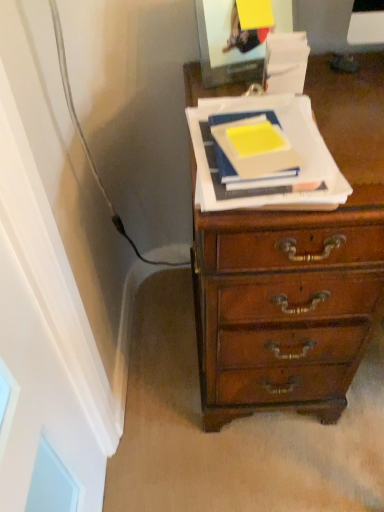
The image size is (384, 512). What are the coordinates of `vacant space behind yellow matte paper at center, the 2th paperback book from the right` in the screenshot? It's located at (252, 104).